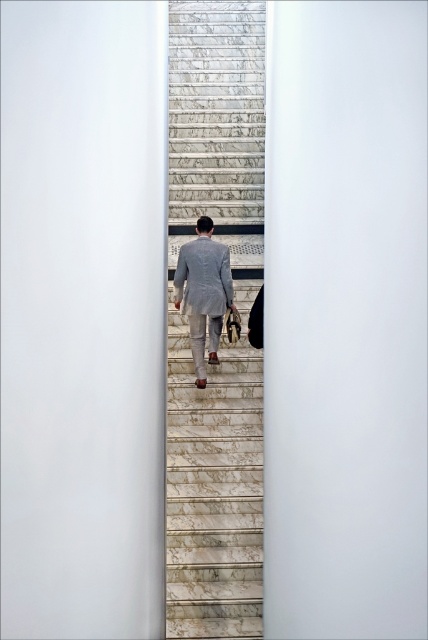
Is marble stairs at center thinner than light gray suit at center?

No, marble stairs at center is not thinner than light gray suit at center.

Is marble stairs at center wider than light gray suit at center?

Yes, marble stairs at center is wider than light gray suit at center.

Who is more distant from viewer, (216, 236) or (216, 294)?

Point (216, 236)

Identify the location of marble stairs at center. Image resolution: width=428 pixels, height=640 pixels. (214, 492).